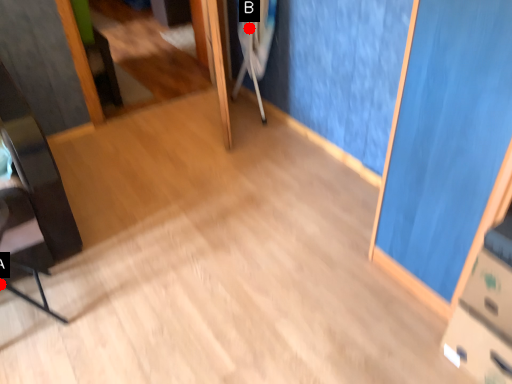
Question: Two points are circled on the image, labeled by A and B beside each circle. Which point appears closest to the camera in this image?

Choices:
 (A) A is closer
 (B) B is closer

Answer: (A)